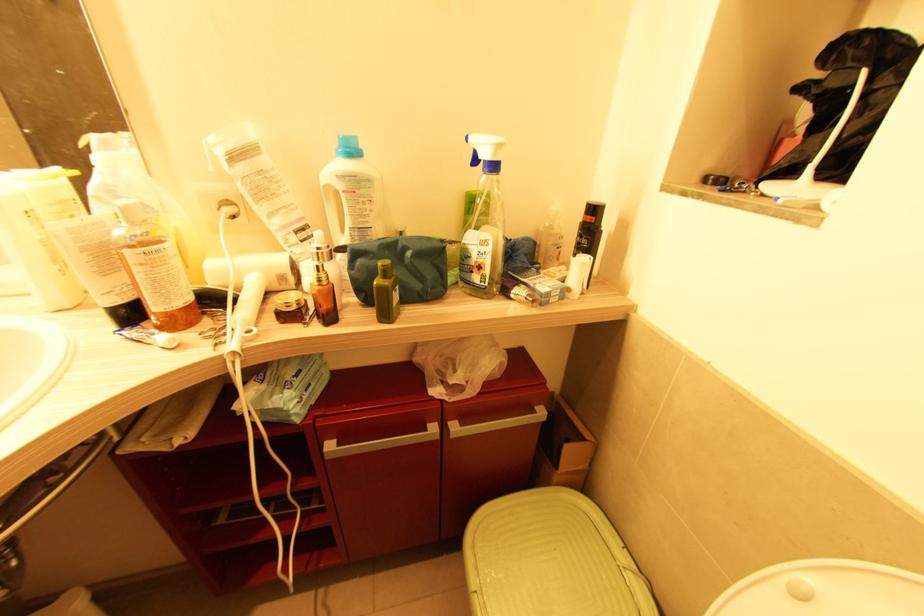
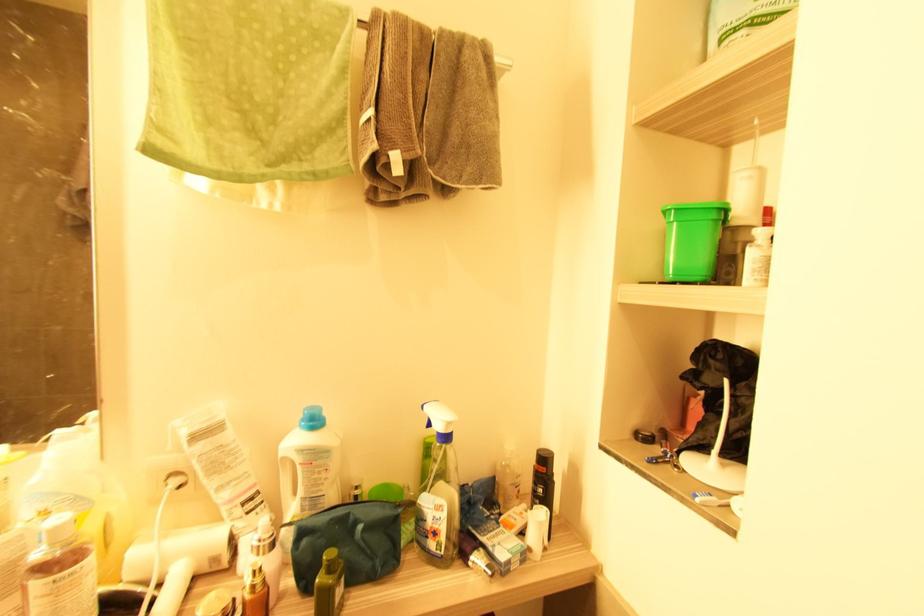
Question: How did the camera likely rotate?

Choices:
 (A) Left
 (B) Right
 (C) Up
 (D) Down

Answer: (C)